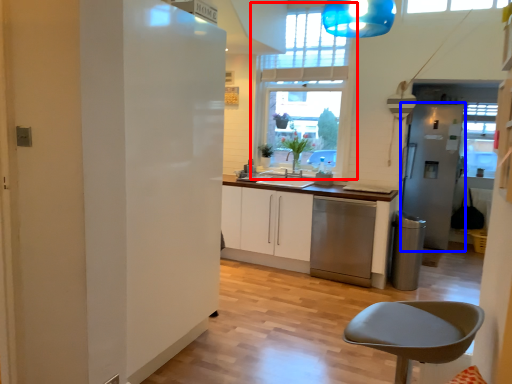
Question: Among these objects, which one is farthest to the camera, window (highlighted by a red box) or fridge (highlighted by a blue box)?

Choices:
 (A) window
 (B) fridge

Answer: (B)